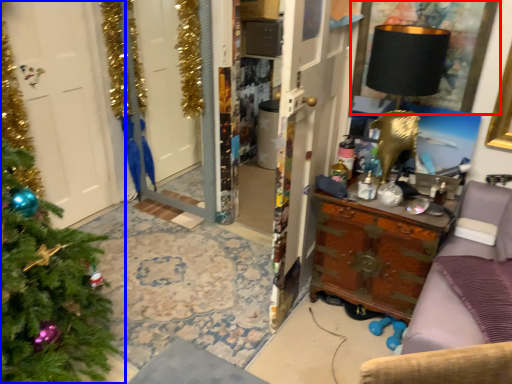
Question: Among these objects, which one is nearest to the camera, picture frame (highlighted by a red box) or christmas tree (highlighted by a blue box)?

Choices:
 (A) picture frame
 (B) christmas tree

Answer: (B)